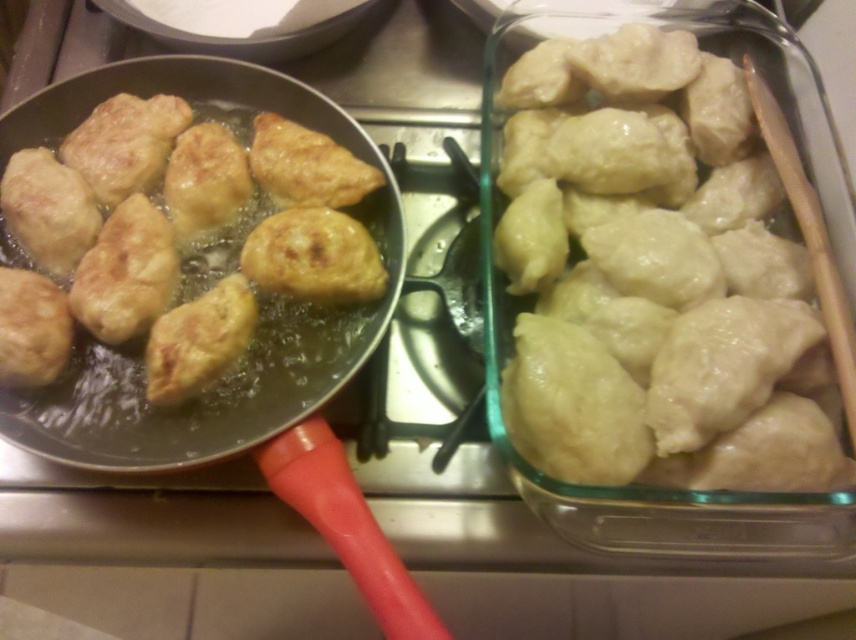
You are a chef preparing dumplings. You have a frying pan with golden brown dough at center and a glass dish with glossy white dumplings at right. Which container should you use to serve the cooked dumplings?

The golden brown dough at center in the frying pan is already cooked, so you should serve the golden brown dough at center from the frying pan.

You are a chef preparing dumplings. You have the glossy white dumplings at right and the shiny metal pan at center. Which one is shorter?

The glossy white dumplings at right are shorter than the shiny metal pan at center.

You are a chef preparing dumplings and notice the golden brown dough at center and the shiny metal pan at center. Which object is positioned higher in the image?

The golden brown dough at center is located above the shiny metal pan at center, so it is positioned higher in the image.